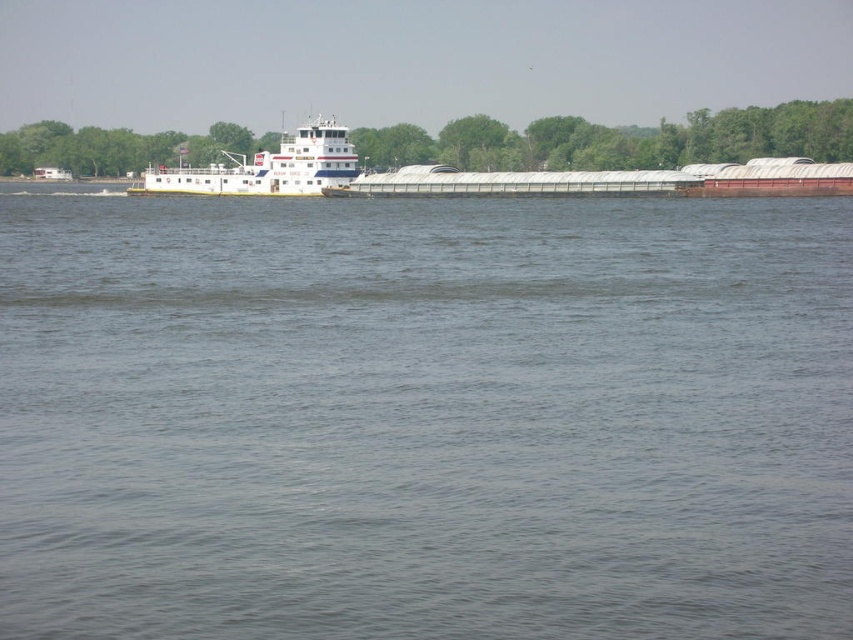
Question: Can you confirm if gray matte water at center is smaller than white glossy barge at center?

Choices:
 (A) yes
 (B) no

Answer: (B)

Question: Which point is closer to the camera?

Choices:
 (A) gray matte water at center
 (B) white glossy barge at center

Answer: (A)

Question: From the image, what is the correct spatial relationship of gray matte water at center in relation to white glossy barge at center?

Choices:
 (A) left
 (B) right

Answer: (B)

Question: Can you confirm if gray matte water at center is wider than white glossy barge at center?

Choices:
 (A) no
 (B) yes

Answer: (B)

Question: Which object appears closest to the camera in this image?

Choices:
 (A) white glossy barge at center
 (B) gray matte water at center

Answer: (B)

Question: Which object is closer to the camera taking this photo?

Choices:
 (A) gray matte water at center
 (B) white glossy barge at center

Answer: (A)